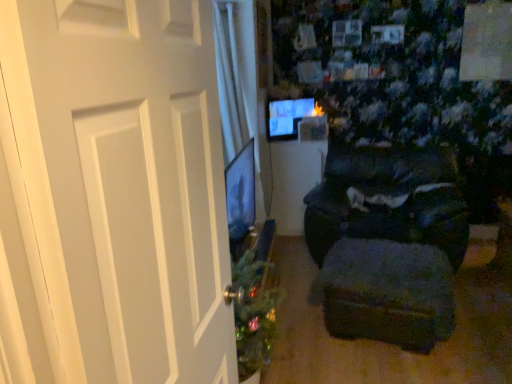
Question: Would you say matte black monitor at upper center is inside or outside white matte door at left?

Choices:
 (A) outside
 (B) inside

Answer: (A)

Question: In terms of height, does matte black monitor at upper center look taller or shorter compared to white matte door at left?

Choices:
 (A) short
 (B) tall

Answer: (A)

Question: Which object is the closest to the dark fabric couch at center?

Choices:
 (A) matte black table at center
 (B) matte black monitor at upper center
 (C) dark fabric ottoman at lower right
 (D) white matte door at left

Answer: (A)

Question: Estimate the real-world distances between objects in this image. Which object is closer to the white matte door at left?

Choices:
 (A) matte black monitor at upper center
 (B) dark fabric couch at center
 (C) dark fabric ottoman at lower right
 (D) matte black table at center

Answer: (C)